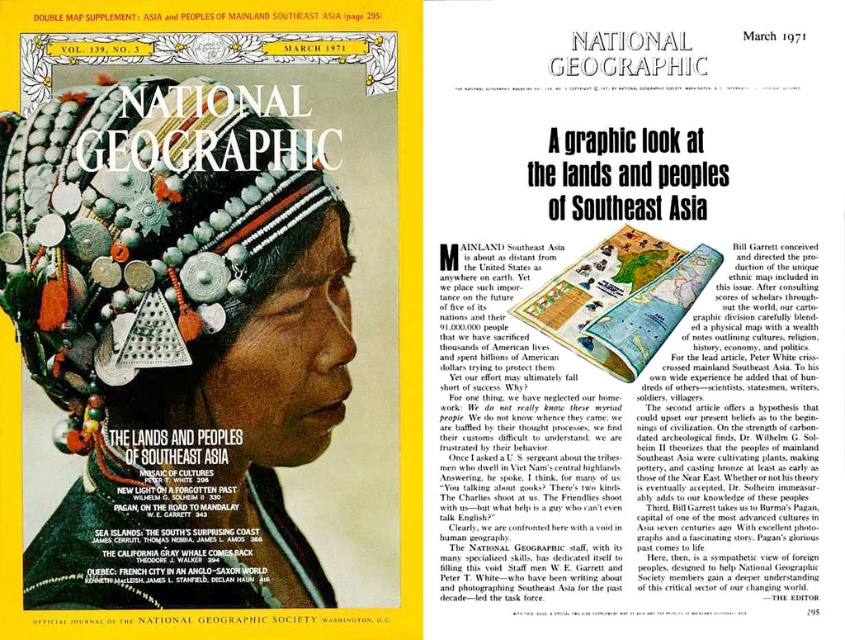
Question: Does silver metallic beads and triangles at center appear under matte paper map at center?

Choices:
 (A) yes
 (B) no

Answer: (B)

Question: Does silver metallic beads and triangles at center appear over matte paper map at center?

Choices:
 (A) yes
 (B) no

Answer: (A)

Question: Does silver metallic beads and triangles at center have a greater width compared to matte paper map at center?

Choices:
 (A) no
 (B) yes

Answer: (B)

Question: Among these objects, which one is nearest to the camera?

Choices:
 (A) matte paper map at center
 (B) silver metallic beads and triangles at center

Answer: (B)

Question: Which point appears farthest from the camera in this image?

Choices:
 (A) (663, 310)
 (B) (243, 163)

Answer: (B)

Question: Which object appears closest to the camera in this image?

Choices:
 (A) silver metallic beads and triangles at center
 (B) matte paper map at center

Answer: (A)